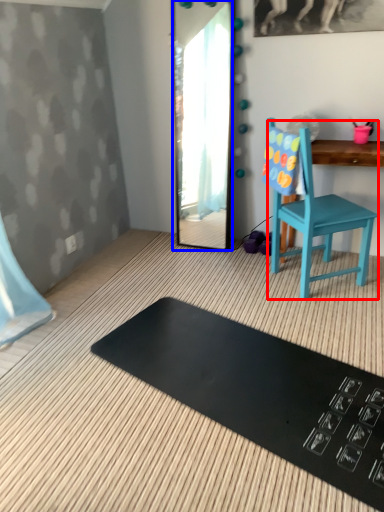
Question: Which point is closer to the camera, chair (highlighted by a red box) or mirror (highlighted by a blue box)?

Choices:
 (A) chair
 (B) mirror

Answer: (A)